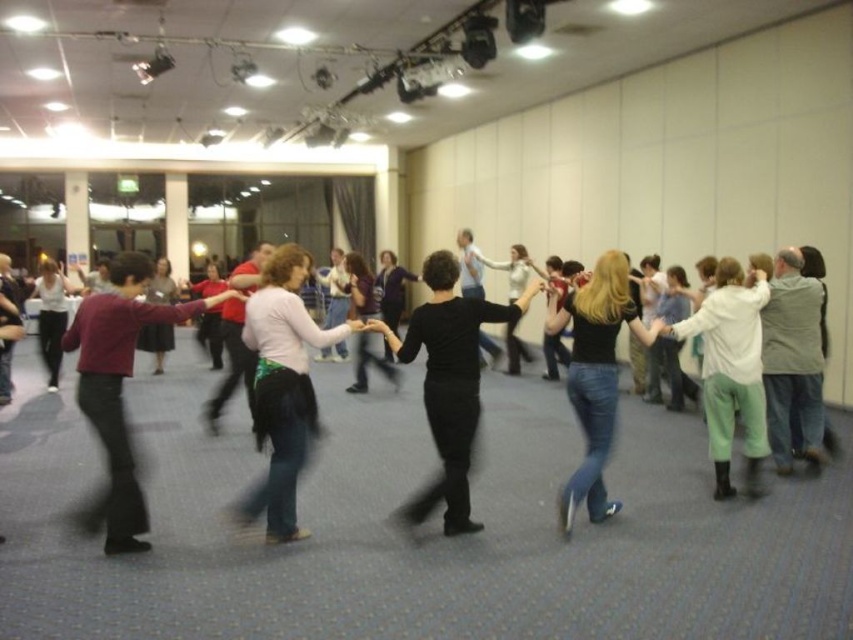
You are a photographer positioned at the entrance of the room. You want to capture a photo that includes both the white matte skirt at center and the maroon sweater at left without moving your camera. Given that your camera has a 60 inch field of view, can you fit both objects in the frame?

The white matte skirt at center is 24.44 inches from the maroon sweater at left. Since the distance between them is less than the camera field of view of 60 inches, you can fit both objects in the frame.

You are standing in the room and want to hand a note to the person wearing the jeans at center and the matte white blouse at center. Which one can you reach first without moving your position?

The jeans at center is closer to the viewer than the matte white blouse at center, so you can reach the person wearing the jeans at center first without moving.